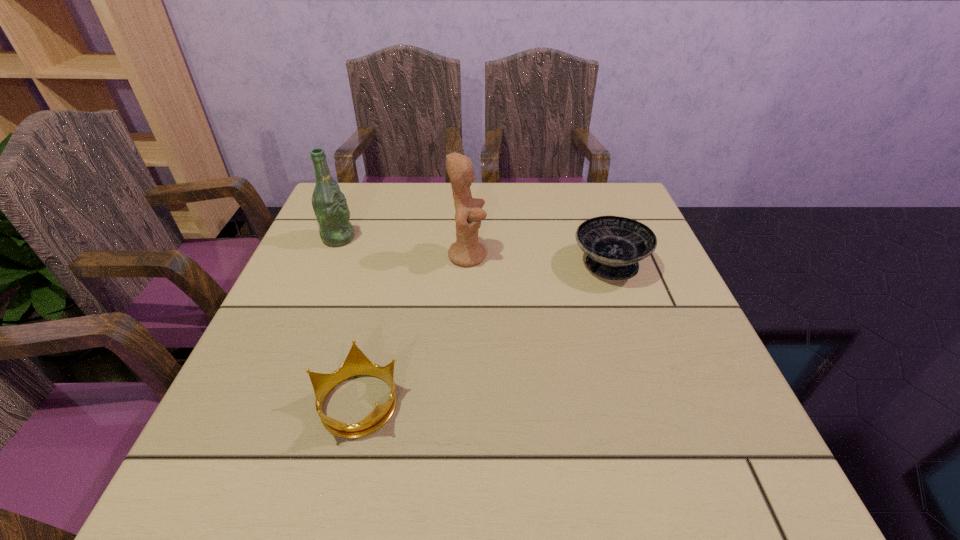
I want to click on figurine, so click(466, 251).

I want to click on beer bottle, so click(x=329, y=204).

Identify the location of the rightmost object. (614, 245).

Where is `the third object from right to left`? Image resolution: width=960 pixels, height=540 pixels. the third object from right to left is located at coordinates (356, 363).

At what (x,y) coordinates should I click in order to perform the action: click on the nearest object. Please return your answer as a coordinate pair (x, y). The image size is (960, 540). Looking at the image, I should click on (356, 363).

Find the location of a particular element. Image resolution: width=960 pixels, height=540 pixels. free space located on the front-facing side of the second object from right to left is located at coordinates (537, 255).

Where is `vacant area located on the surface of the beer bottle`? vacant area located on the surface of the beer bottle is located at coordinates (490, 238).

Where is `free spot located on the back of the rightmost object`? free spot located on the back of the rightmost object is located at coordinates (592, 216).

This screenshot has width=960, height=540. In order to click on free space located on the right of the nearest object in this screenshot , I will do `click(522, 402)`.

Locate an element on the screen. Image resolution: width=960 pixels, height=540 pixels. beer bottle positioned at the left edge is located at coordinates (329, 204).